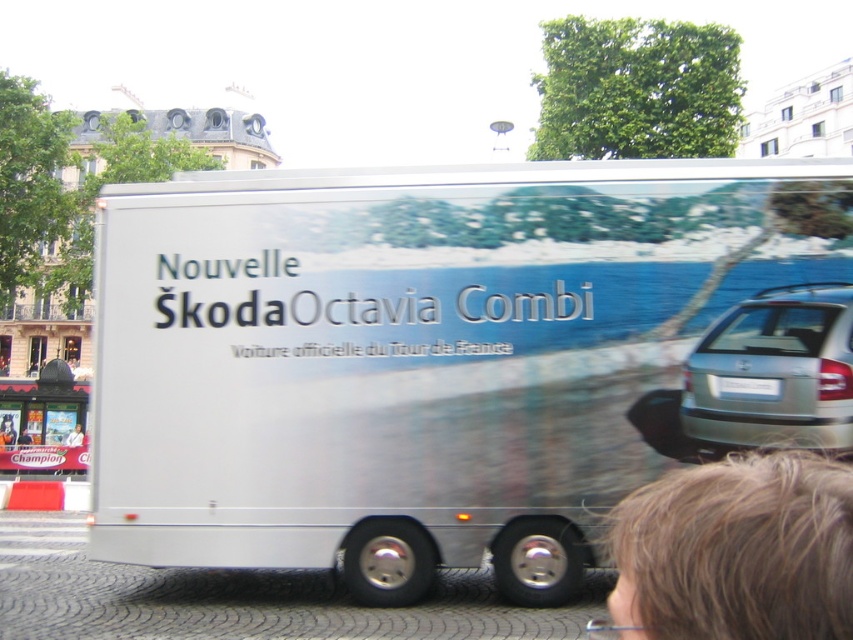
Question: Is white matte bus at lower left wider than smooth black hair at lower right?

Choices:
 (A) yes
 (B) no

Answer: (A)

Question: Is blonde hair at lower right positioned before white matte bus at lower left?

Choices:
 (A) no
 (B) yes

Answer: (B)

Question: Is blonde hair at lower right to the right of light brown hair at lower right from the viewer's perspective?

Choices:
 (A) yes
 (B) no

Answer: (A)

Question: Which is farther from the white matte bus at lower left?

Choices:
 (A) blonde hair at lower right
 (B) light brown hair at lower right
 (C) white metallic truck at center
 (D) smooth black hair at lower right

Answer: (A)

Question: Which object appears closest to the camera in this image?

Choices:
 (A) light brown hair at lower right
 (B) white metallic truck at center
 (C) silver metallic car at right

Answer: (C)

Question: Which object is closer to the camera taking this photo?

Choices:
 (A) silver metallic car at right
 (B) light brown hair at lower right
 (C) white matte bus at lower left

Answer: (A)